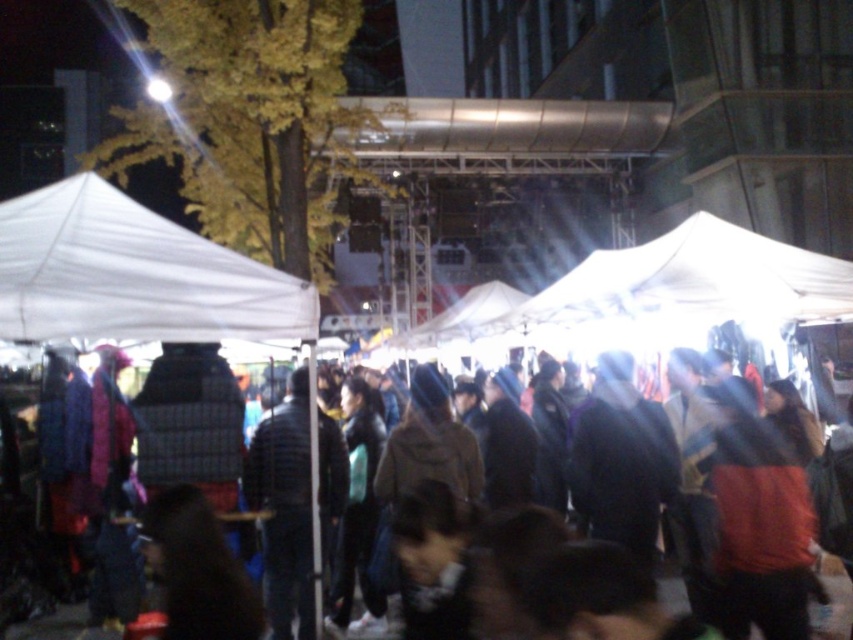
You are standing at the center of the event area and want to find the white fabric canopy at left. According to the coordinates provided, in which direction should you move to locate it?

The white fabric canopy at left is located at coordinates point (132,275). Since you are at the center, moving towards the left direction will help you find it.

You are at a night market and want to walk from the tree with yellow leaves to the white fabric canopy at left. The path is straight. If your walking speed is 3 feet per second, how many seconds will it take you to reach the canopy?

The distance between the tree with yellow leaves and the white fabric canopy at left is 13.91 feet. At a speed of 3 feet per second, it would take approximately 4.64 seconds to reach the canopy.

You are attending a night market and see the white fabric canopy at left and the brown fabric crowd at center. Which object is positioned to the left of the other?

The white fabric canopy at left is to the left of the brown fabric crowd at center.